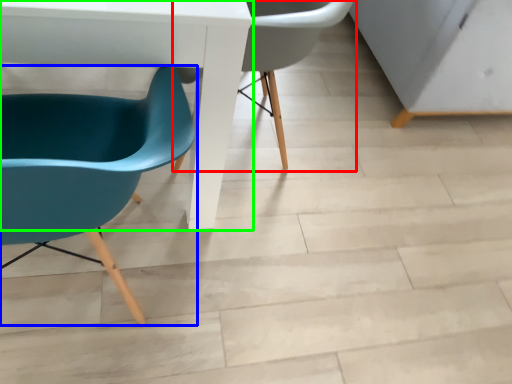
Question: Which object is positioned farthest from chair (highlighted by a red box)? Select from chair (highlighted by a blue box) and table (highlighted by a green box).

Choices:
 (A) chair
 (B) table

Answer: (A)